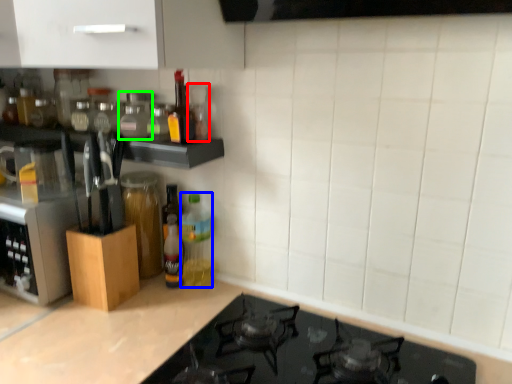
Question: Considering the real-world distances, which object is farthest from bottle (highlighted by a red box)? bottle (highlighted by a blue box) or bottle (highlighted by a green box)?

Choices:
 (A) bottle
 (B) bottle

Answer: (A)